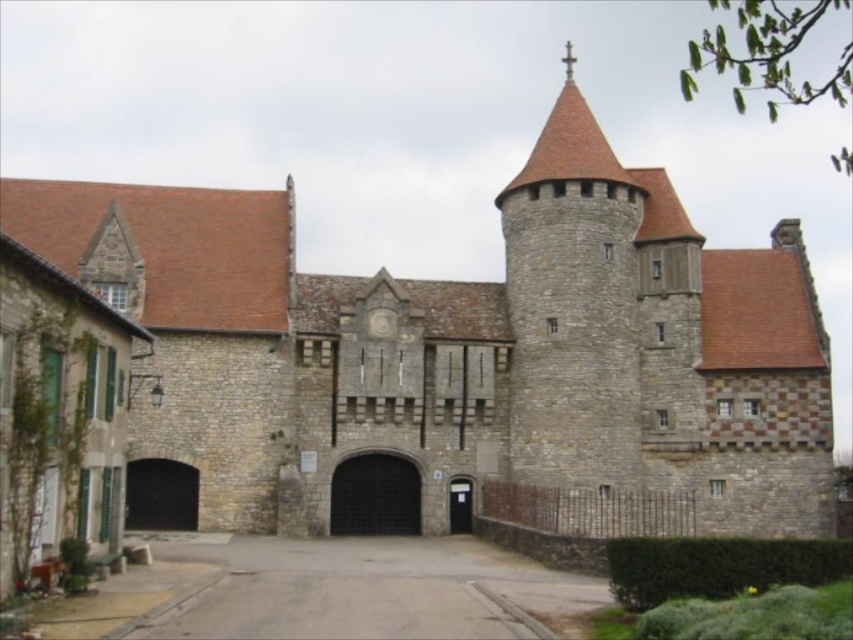
You are a visitor arriving at the historic stone building and want to enter through the main entrance. You see the gray asphalt driveway at center and the black metal gate at center. Which object is lower in position?

The gray asphalt driveway at center is below the black metal gate at center, so the driveway is lower in position.

You are a visitor approaching the historic stone building and want to enter through the dark gray stone gate at center. However, there is a dark brown stone archway at lower left in your path. Which structure should you pass under first?

You should pass under the dark brown stone archway at lower left first because the dark gray stone gate at center is located above it.

Consider the image. You are a delivery driver approaching the historic stone building. You need to park your vehicle on the gray asphalt driveway at center. However, the dark gray stone gate at center is closed. Can you drive through the driveway to reach the gate?

The gray asphalt driveway at center is in front of the dark gray stone gate at center, so you can drive through the driveway to reach the gate.